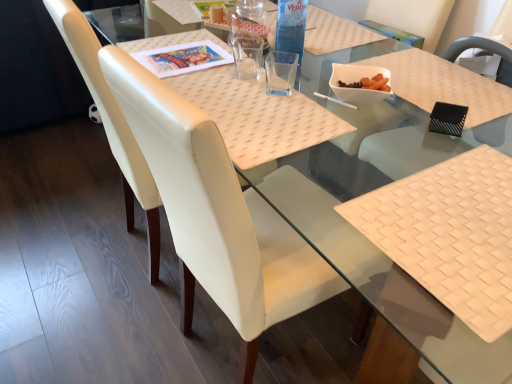
I want to click on free space to the left of white leather chair at center, acting as the 2th chair starting from the right, so (103, 325).